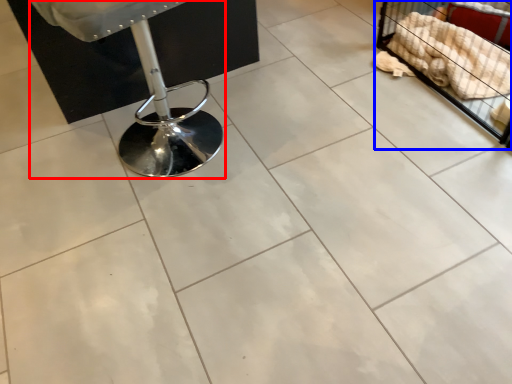
Question: Which of the following is the farthest to the observer, swivel chair (highlighted by a red box) or furniture (highlighted by a blue box)?

Choices:
 (A) swivel chair
 (B) furniture

Answer: (B)